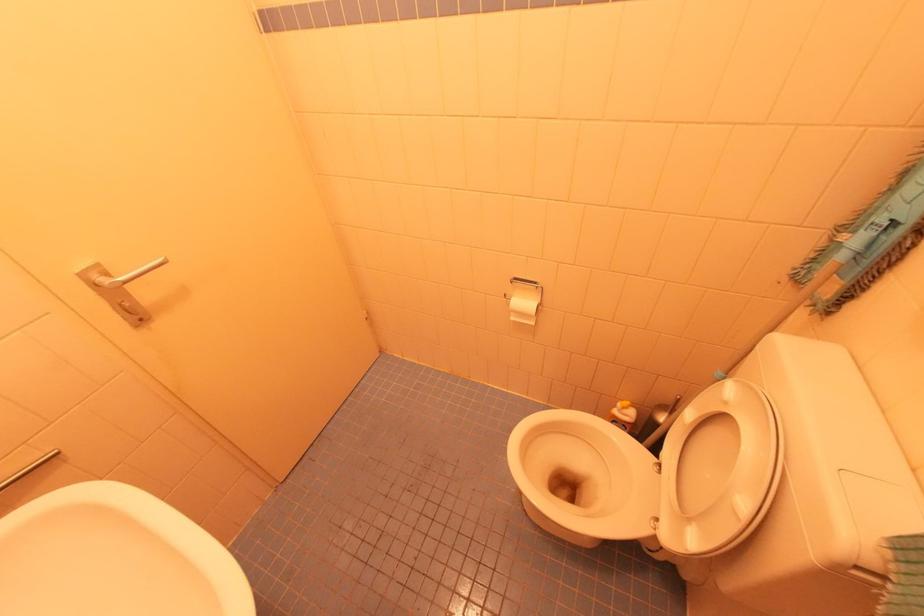
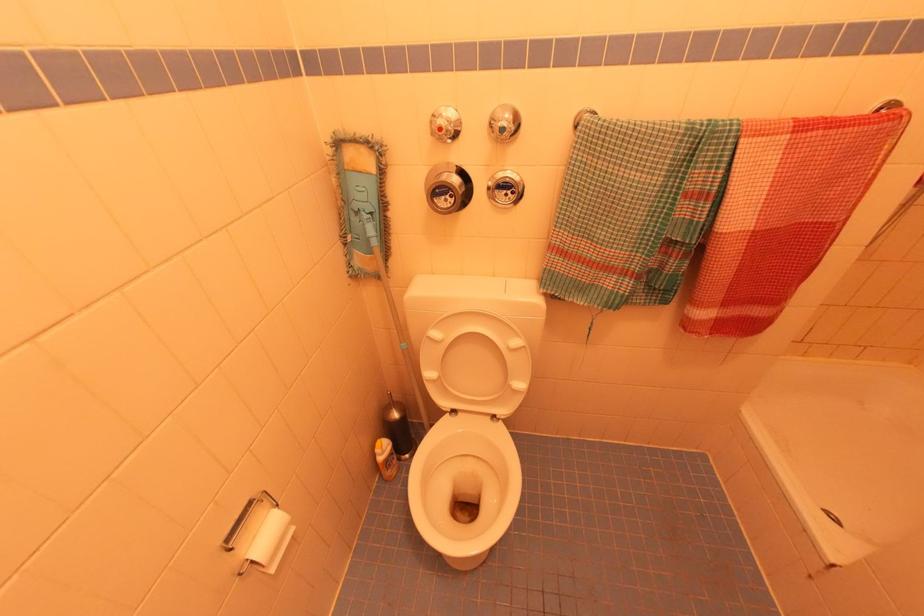
Where in the second image is the point corresponding to the point at 514,318 from the first image?

(274, 570)